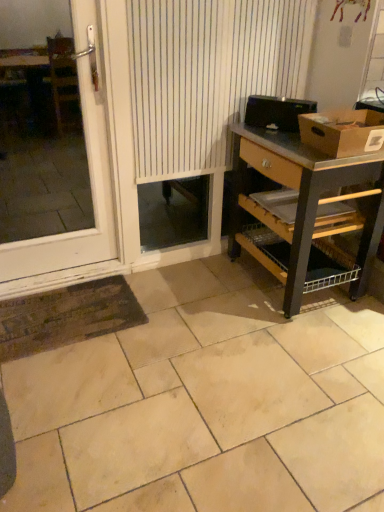
At what (x,y) coordinates should I click in order to perform the action: click on vacant space situated on the left part of wooden desk at right. Please return your answer as a coordinate pair (x, y). This screenshot has width=384, height=512. Looking at the image, I should click on (192, 296).